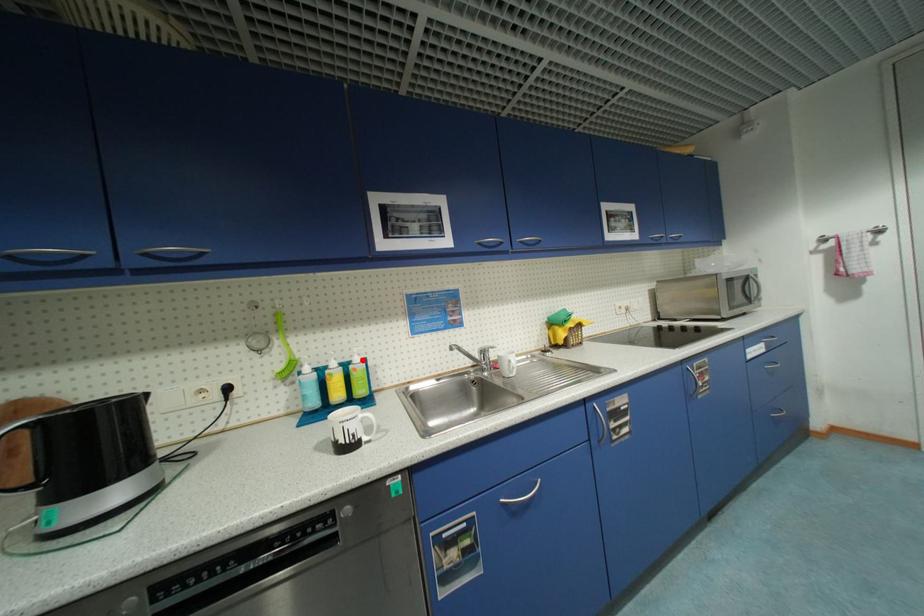
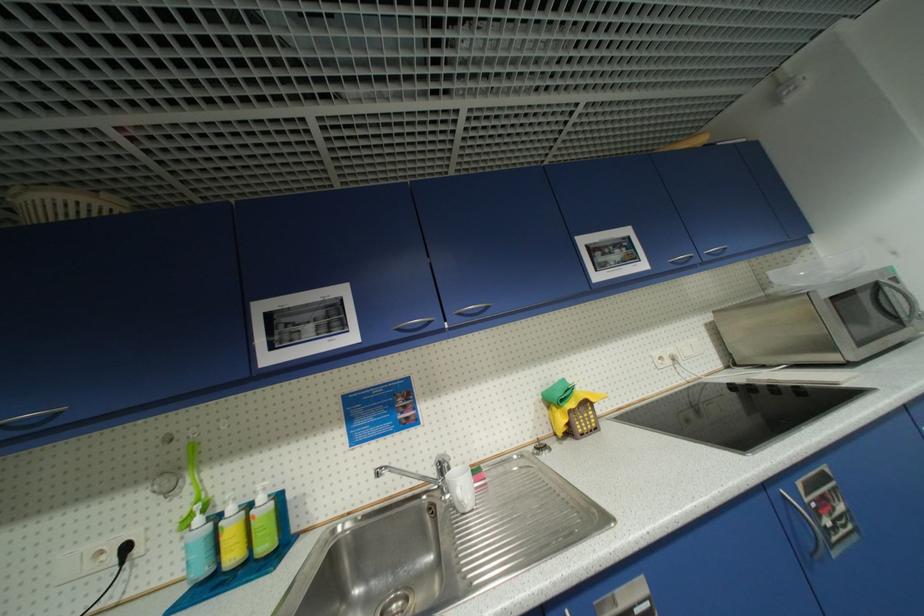
Where in the second image is the point corresponding to the highlighted location from the first image?

(266, 500)